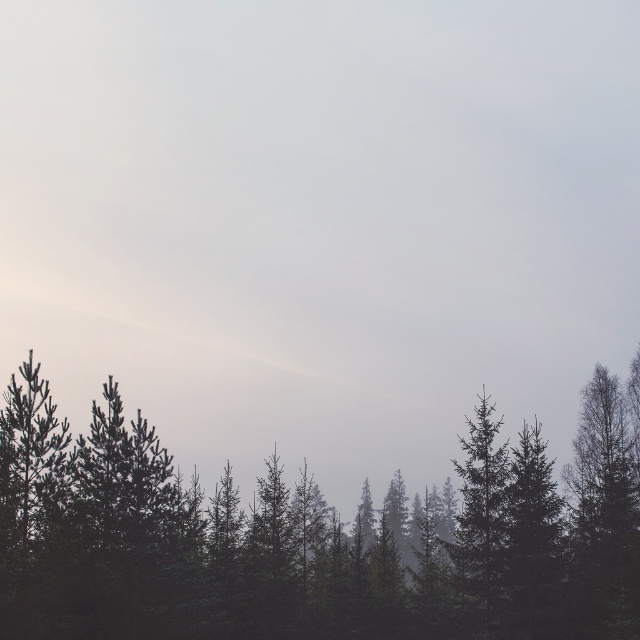
You are a hiker navigating through the forest and want to reach a clearing. You see the dark green trees at lower center and the green matte tree at center. Which tree is closer to you?

The dark green trees at lower center is positioned under green matte tree at center, so the dark green trees at lower center is closer to you.

You are an observer in the forest scene. You see the dark green trees at lower center and the green matte tree at center. Which tree is located to the left of the other?

The dark green trees at lower center is positioned on the left side of green matte tree at center.

You are a bird flying towards the dark green trees at lower center and the green matte tree at center. Which tree will you reach first?

The green matte tree at center will be reached first because it is shorter than the dark green trees at lower center, so it is closer to the ground and therefore closer to the bird flying towards them.